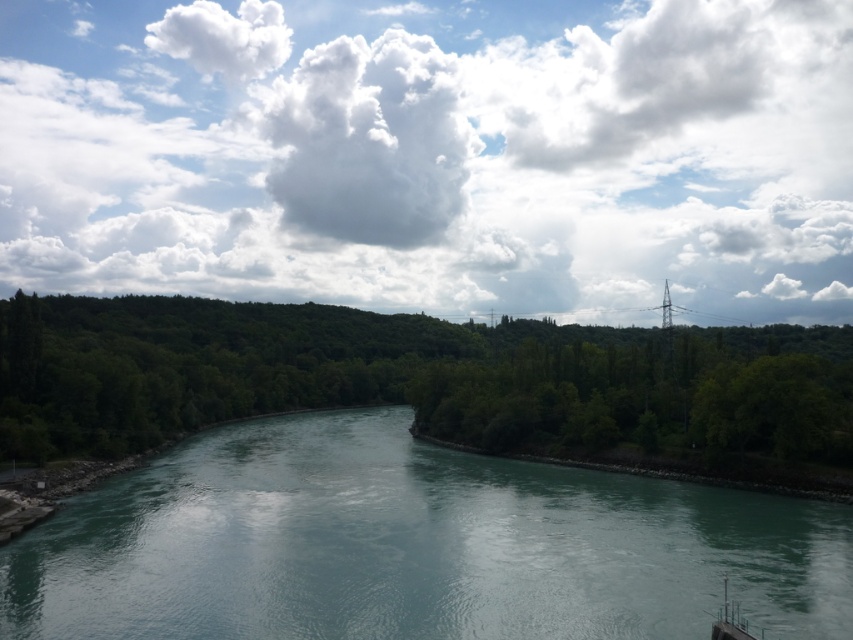
Who is positioned more to the right, teal smooth water at center or green leafy trees at left?

From the viewer's perspective, green leafy trees at left appears more on the right side.

Identify the location of teal smooth water at center. 415,547.

Image resolution: width=853 pixels, height=640 pixels. Describe the element at coordinates (432, 154) in the screenshot. I see `white fluffy cloud at upper center` at that location.

Find the location of a particular element. white fluffy cloud at upper center is located at coordinates (432, 154).

Does point (171, 170) come behind point (844, 390)?

Yes, point (171, 170) is behind point (844, 390).

Can you confirm if white fluffy cloud at upper center is positioned below green leafy trees at left?

No.

You are a GUI agent. You are given a task and a screenshot of the screen. Output one action in this format:
    pyautogui.click(x=<x>, y=<y>)
    Task: Click on the white fluffy cloud at upper center
    
    Given the screenshot: What is the action you would take?
    pyautogui.click(x=432, y=154)